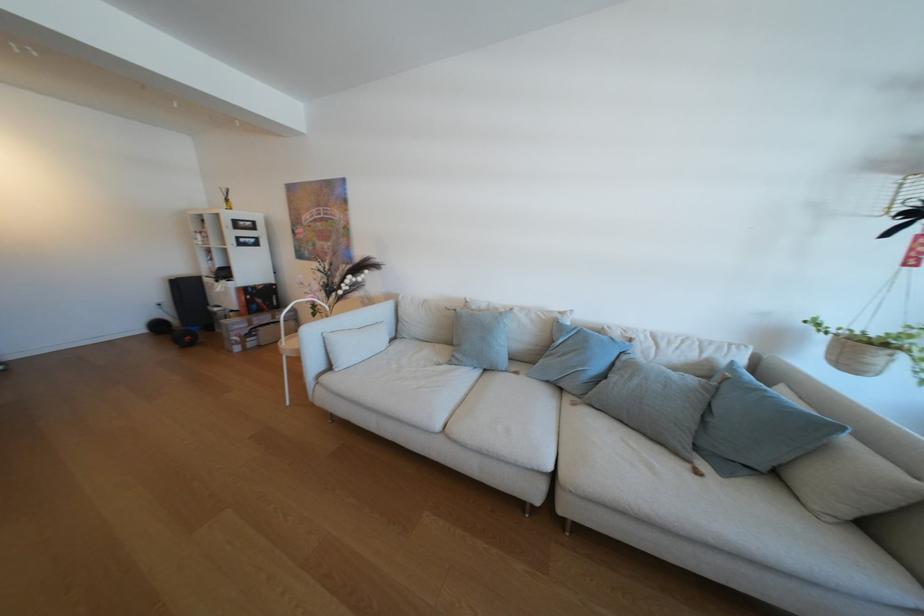
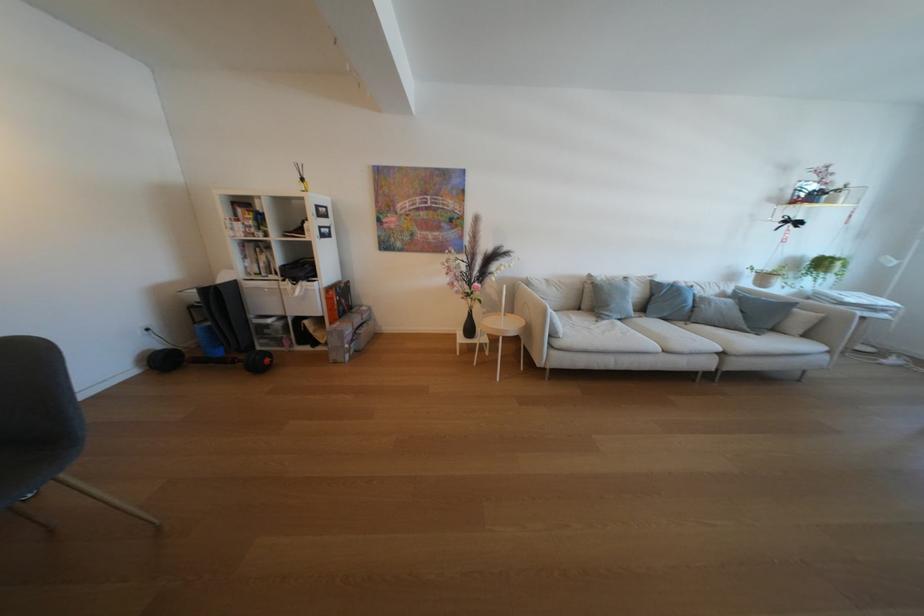
Find the pixel in the second image that matches [494,307] in the first image.

(614, 278)